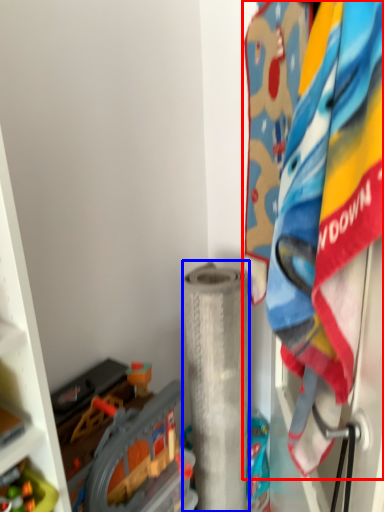
Question: Which point is closer to the camera, laundry (highlighted by a red box) or toilet paper (highlighted by a blue box)?

Choices:
 (A) laundry
 (B) toilet paper

Answer: (A)